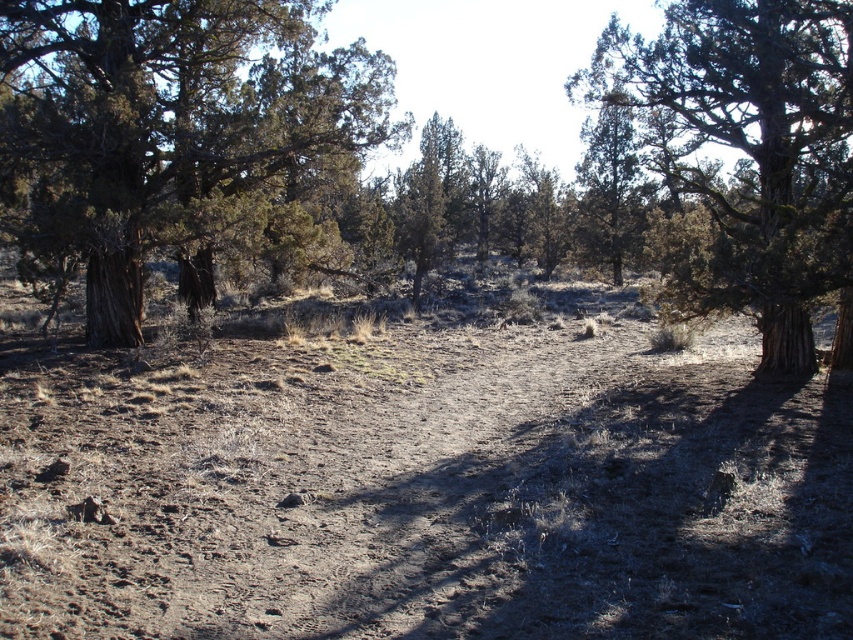
You are hiking in this landscape and want to take a photo of both the dark brown bark tree at upper left and the green textured tree at center. Which tree should you move closer to in order to include both in your photo frame?

To include both the dark brown bark tree at upper left and the green textured tree at center in your photo frame, you should move closer to the dark brown bark tree at upper left since it is closer to you than the green textured tree at center.

You are a hiker trying to navigate through the dry landscape. You see the brown textured trees at center and the dark brown bark tree at upper left. Which tree would cast a longer shadow based on their size?

The brown textured trees at center is larger in size than the dark brown bark tree at upper left, so it would cast a longer shadow.

You are standing at the center of this open landscape. You want to locate the dark brown bark tree at upper left. According to the coordinates provided, in which direction should you look to find it?

You should look towards the upper left direction to find the dark brown bark tree at upper left, as it is located at point (180, 134) which corresponds to the upper left corner of the scene.